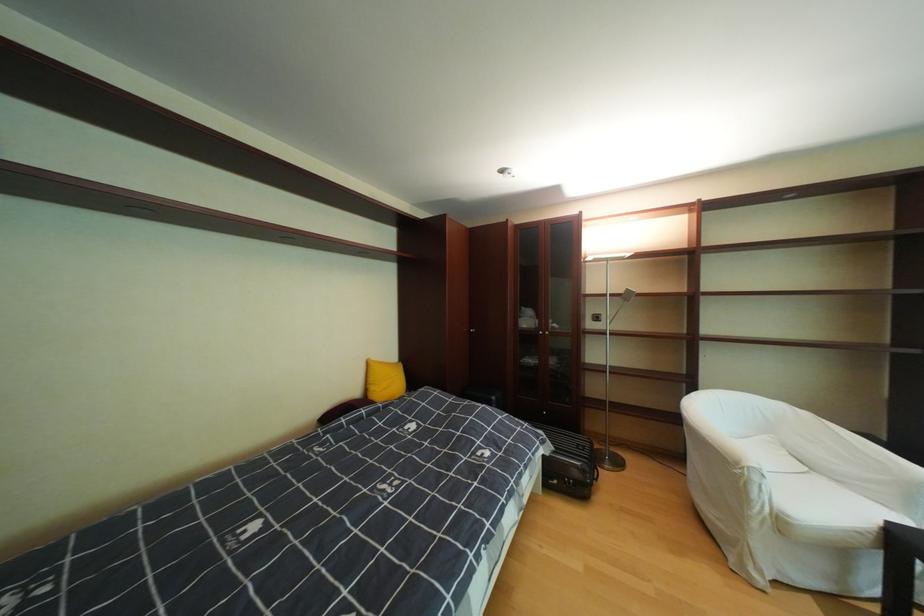
The location [568,463] corresponds to which object?

It corresponds to the black suitcase in the image.